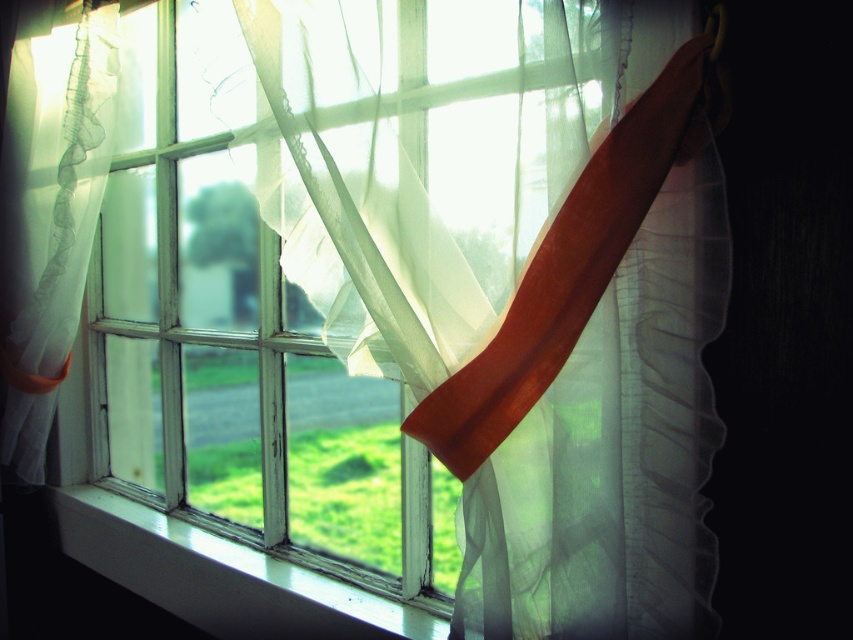
Which is below, translucent white curtain at center or white painted wood at lower center?

Positioned lower is white painted wood at lower center.

Between point (509, 86) and point (136, 516), which one is positioned in front?

Point (509, 86) is more forward.

Locate an element on the screen. translucent white curtain at center is located at coordinates [515, 282].